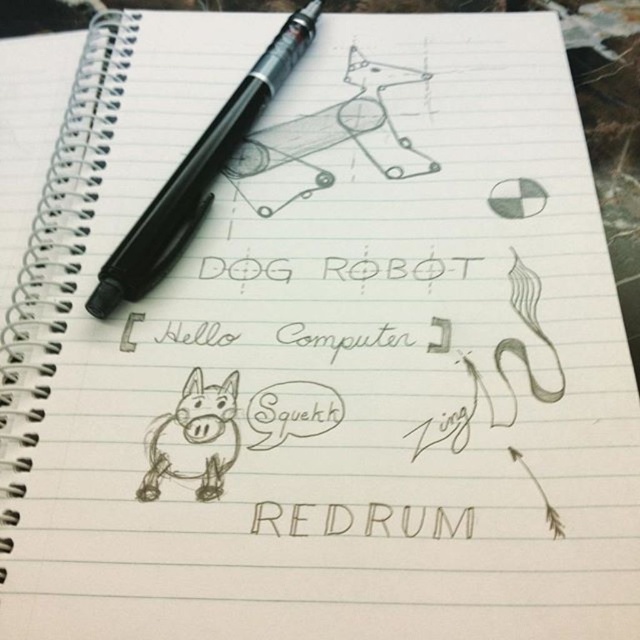
Question: Can you confirm if black plastic pen at upper left is positioned to the right of brown sketchy donkey at lower left?

Choices:
 (A) yes
 (B) no

Answer: (A)

Question: Is brown sketchy donkey at lower left in front of black ink word at center?

Choices:
 (A) no
 (B) yes

Answer: (A)

Question: Estimate the real-world distances between objects in this image. Which object is closer to the black plastic pen at upper left?

Choices:
 (A) black ink word at center
 (B) brown sketchy donkey at lower left

Answer: (B)

Question: Which object is the farthest from the black ink word at center?

Choices:
 (A) brown sketchy donkey at lower left
 (B) black plastic pen at upper left

Answer: (B)

Question: Considering the real-world distances, which object is farthest from the black plastic pen at upper left?

Choices:
 (A) brown sketchy donkey at lower left
 (B) black ink word at center

Answer: (B)

Question: Can you confirm if black plastic pen at upper left is positioned above black ink word at center?

Choices:
 (A) no
 (B) yes

Answer: (B)